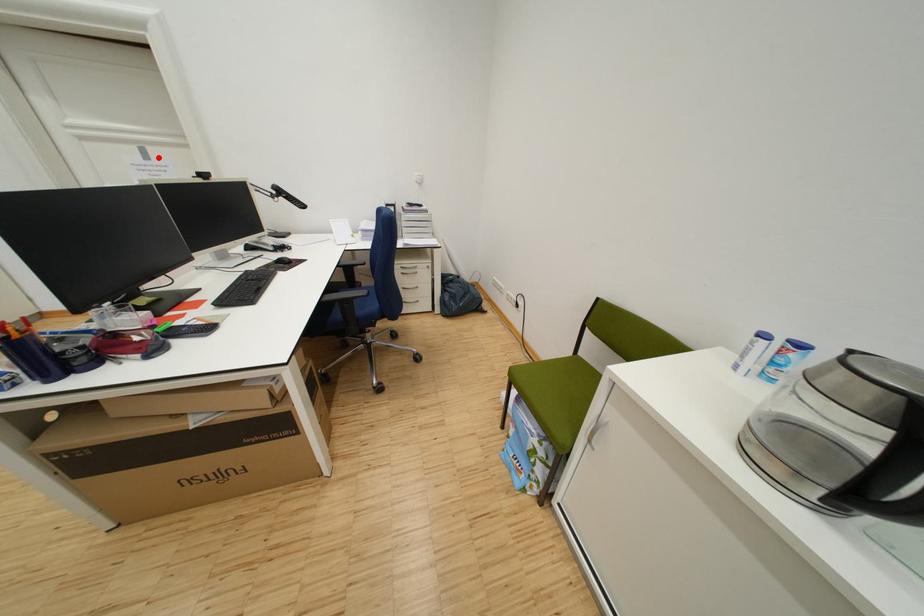
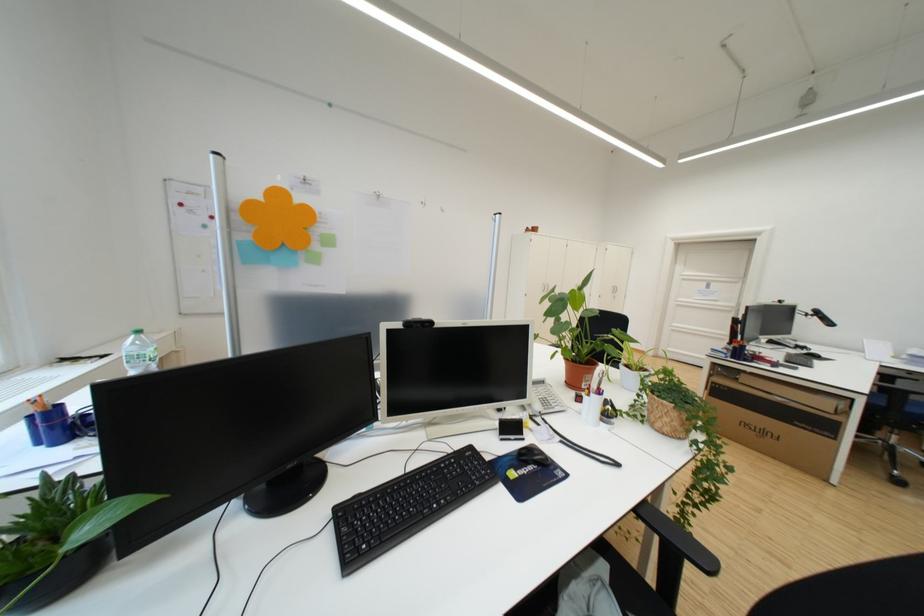
Find the pixel in the second image that matches the highlighted location in the first image.

(720, 288)